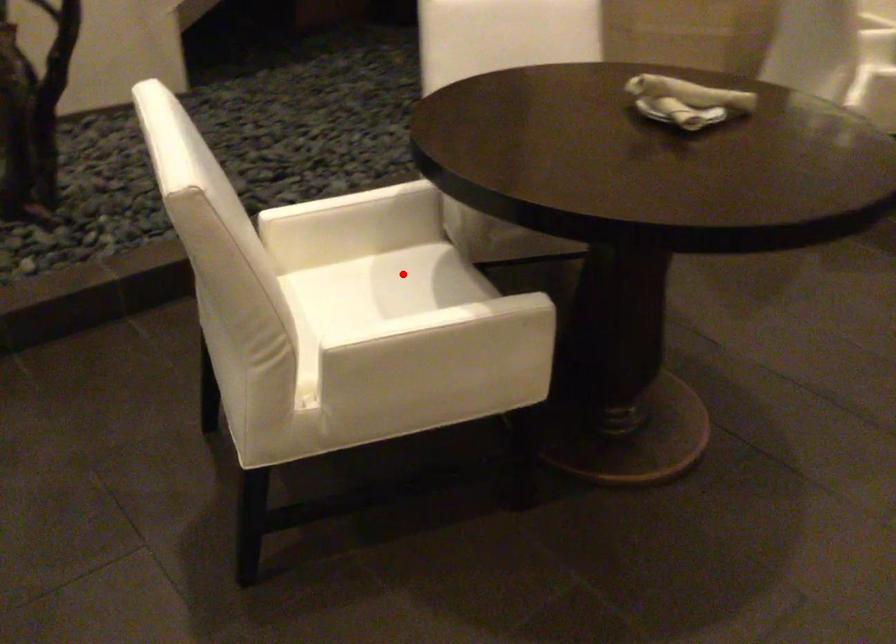
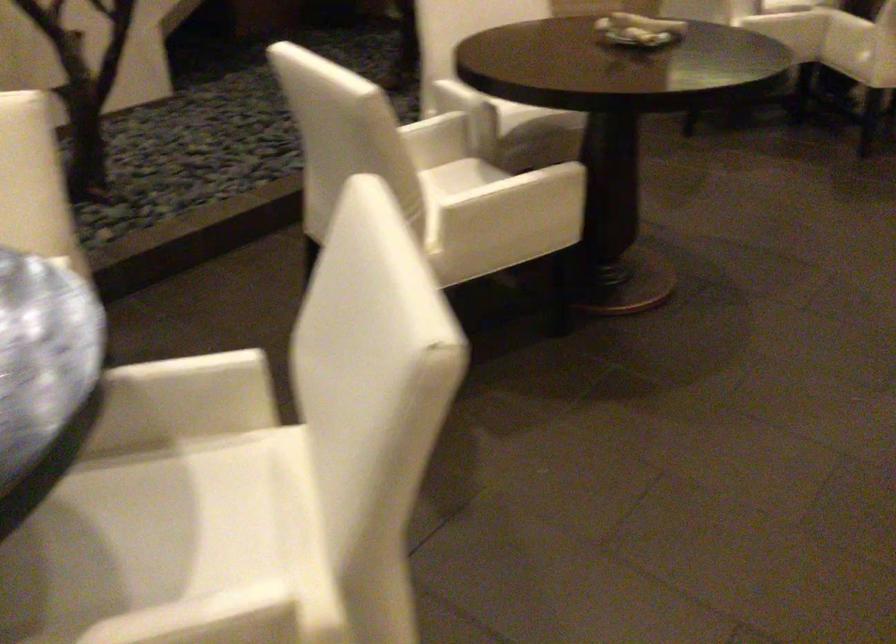
Question: I am providing you with two images of the same scene from different viewpoints. In image1, a red point is highlighted. Considering the same 3D point in image2, which of the following is correct?

Choices:
 (A) It is closer
 (B) It is farther

Answer: (B)